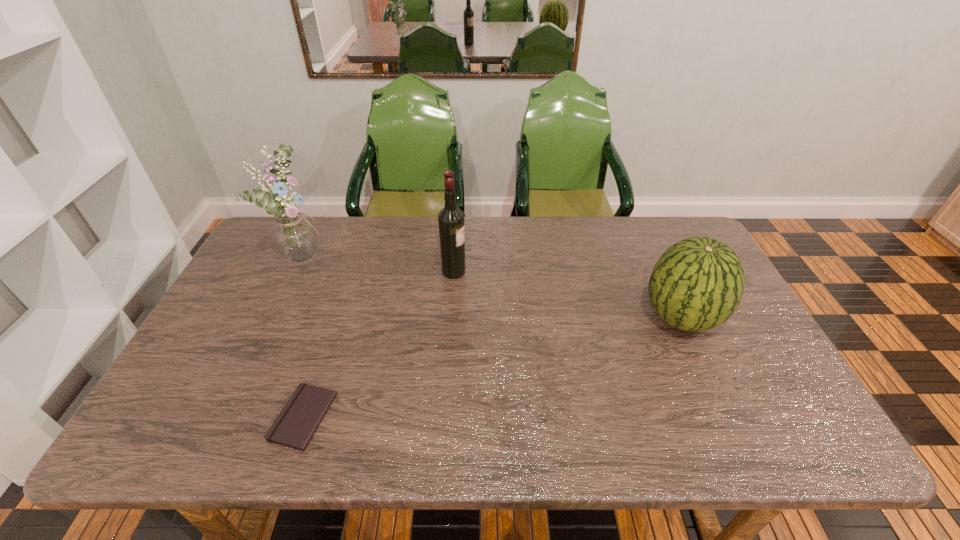
The height and width of the screenshot is (540, 960). What are the coordinates of `bouquet` in the screenshot? It's located at (294, 235).

In order to click on the third object from left to right in this screenshot , I will do `click(451, 224)`.

The width and height of the screenshot is (960, 540). Identify the location of the rightmost object. (697, 284).

At what (x,y) coordinates should I click in order to perform the action: click on the third farthest object. Please return your answer as a coordinate pair (x, y). Looking at the image, I should click on (697, 284).

This screenshot has height=540, width=960. In order to click on checkbook in this screenshot , I will do `click(294, 427)`.

This screenshot has width=960, height=540. I want to click on the nearest object, so click(294, 427).

This screenshot has height=540, width=960. Identify the location of vacant space situated 0.270m on the front-facing side of the leftmost object. (411, 254).

You are a GUI agent. You are given a task and a screenshot of the screen. Output one action in this format:
    pyautogui.click(x=<x>, y=<y>)
    Task: Click on the vacant area situated on the front and back of the second object from right to left
    This screenshot has width=960, height=540.
    Given the screenshot: What is the action you would take?
    pyautogui.click(x=546, y=272)

At what (x,y) coordinates should I click in order to perform the action: click on vacant space located on the back of the third farthest object. Please return your answer as a coordinate pair (x, y). The height and width of the screenshot is (540, 960). Looking at the image, I should click on (650, 251).

Where is `vacant space located on the back of the third object from right to left`? This screenshot has height=540, width=960. vacant space located on the back of the third object from right to left is located at coordinates (335, 321).